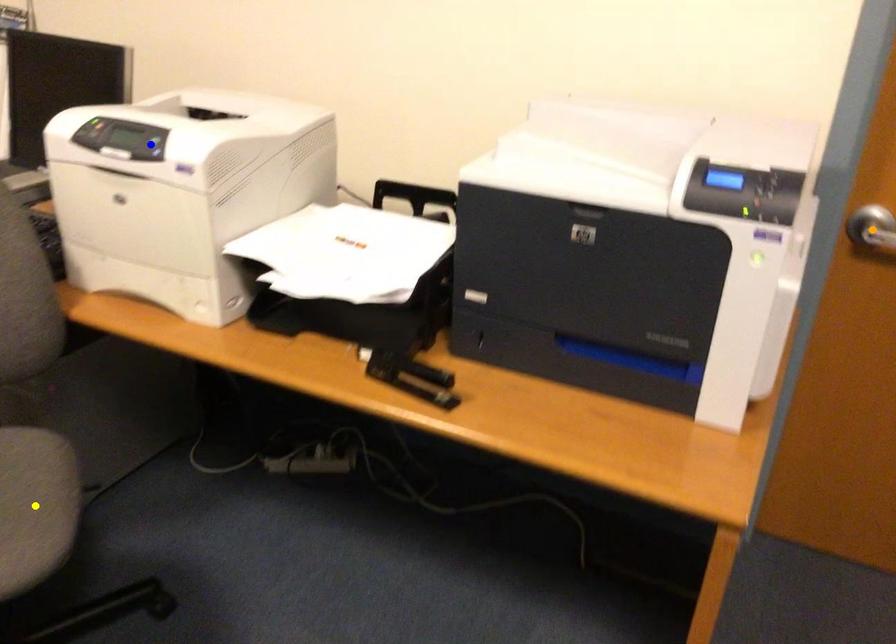
Order these from nearest to farthest:
- orange point
- yellow point
- blue point

1. yellow point
2. blue point
3. orange point